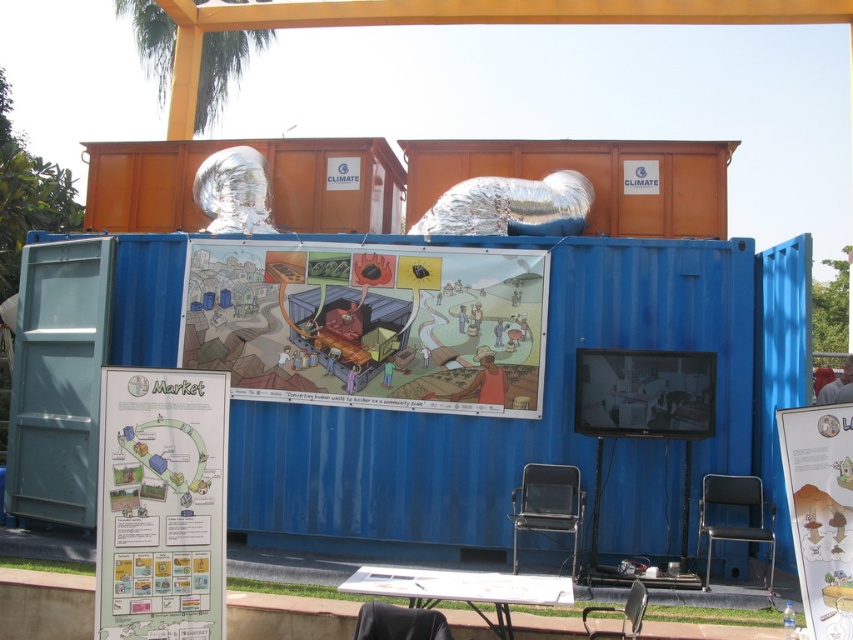
Question: Based on their relative distances, which object is nearer to the white paper at center?

Choices:
 (A) cartoon illustration at center
 (B) matte white poster at center

Answer: (B)

Question: Considering the relative positions of cartoon illustration at center and white paper at center in the image provided, where is cartoon illustration at center located with respect to white paper at center?

Choices:
 (A) below
 (B) above

Answer: (B)

Question: Can you confirm if white paper at center is thinner than matte white poster at center?

Choices:
 (A) yes
 (B) no

Answer: (B)

Question: Which point appears closest to the camera in this image?

Choices:
 (A) (817, 621)
 (B) (538, 401)
 (C) (195, 426)

Answer: (A)

Question: Among these objects, which one is farthest from the camera?

Choices:
 (A) white paper at center
 (B) matte white poster at center
 (C) cartoon illustration at center

Answer: (C)

Question: Is cartoon illustration at center positioned in front of white paper at center?

Choices:
 (A) yes
 (B) no

Answer: (B)